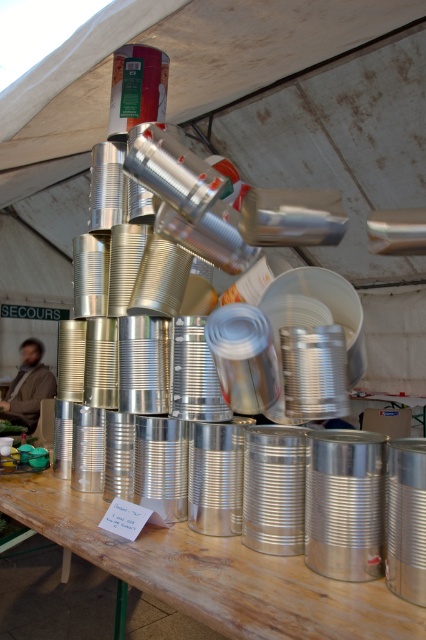
You are standing at the point marked as point (213, 572). What object is located exactly at that point?

The wooden table at center is located exactly at point (213, 572).

You are standing at the entrance of the tent and want to retrieve your brown fuzzy jacket at lower left. Is the wooden table at center blocking your path to the jacket?

The wooden table at center is in front of the brown fuzzy jacket at lower left, so it is blocking the path to the jacket.